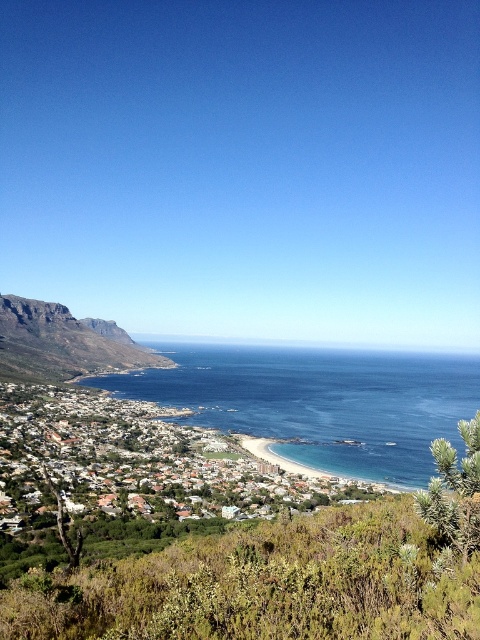
You are a photographer standing at the edge of the coastal landscape. You want to capture a photo where both the blue water at center and the white matte houses at center are clearly visible. Based on their positions, which object will appear larger in the photo?

The blue water at center will appear larger in the photo because it is closer to the viewer than the white matte houses at center.

You are standing at the point labeled point [31,387] and want to walk towards the point labeled point [78,321]. Which direction should you face to move closer to your destination?

Since point [31,387] is closer to the viewer than point [78,321], you should face away from the viewer to move towards your destination.